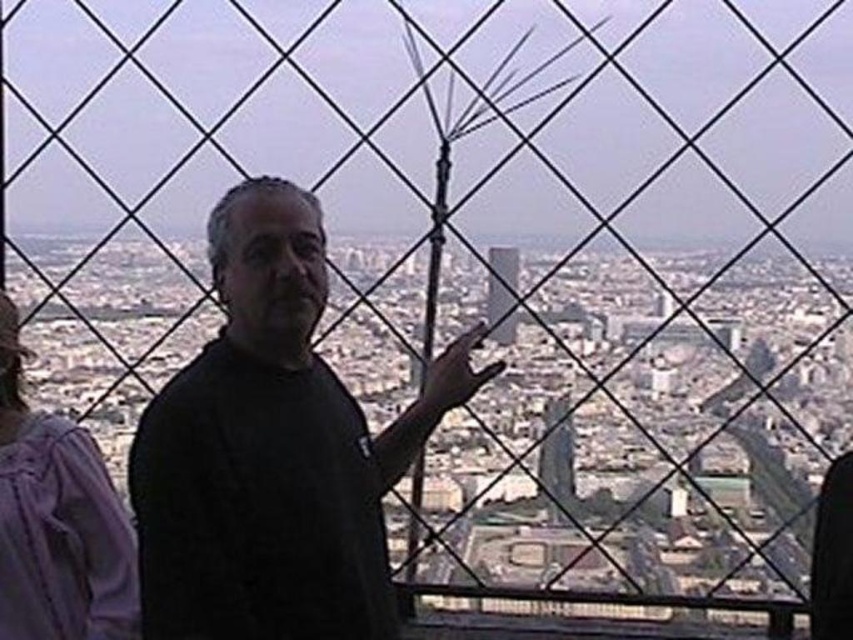
Question: Is smooth glass skyscraper at center wider than glassy reflective skyscraper at center?

Choices:
 (A) yes
 (B) no

Answer: (A)

Question: Which point is farther from the camera taking this photo?

Choices:
 (A) (495, 330)
 (B) (564, 408)

Answer: (B)

Question: Which of the following is the closest to the observer?

Choices:
 (A) (86, 435)
 (B) (222, 570)

Answer: (B)

Question: Which of the following is the farthest from the observer?

Choices:
 (A) purple cotton hoodie at left
 (B) glassy reflective skyscraper at center
 (C) black matte shirt at center

Answer: (B)

Question: Is smooth glass skyscraper at center thinner than glassy reflective skyscraper at center?

Choices:
 (A) no
 (B) yes

Answer: (A)

Question: Is black matte shirt at center wider than glassy reflective skyscraper at center?

Choices:
 (A) no
 (B) yes

Answer: (B)